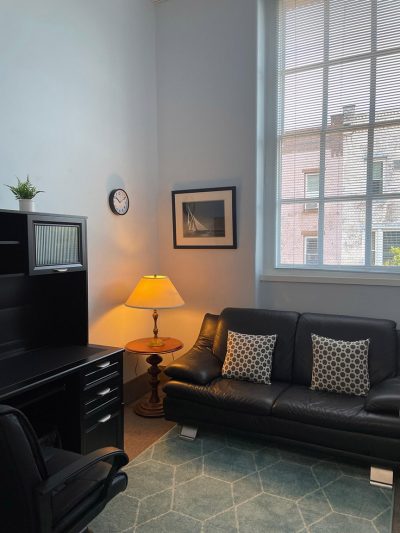
Where is `wall`? This screenshot has height=533, width=400. wall is located at coordinates (139, 51).